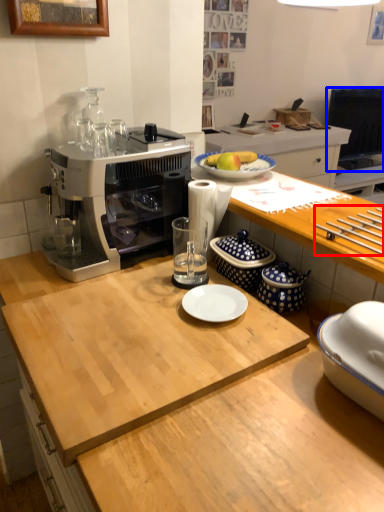
Question: Which of the following is the closest to the observer, tableware (highlighted by a red box) or television (highlighted by a blue box)?

Choices:
 (A) tableware
 (B) television

Answer: (A)